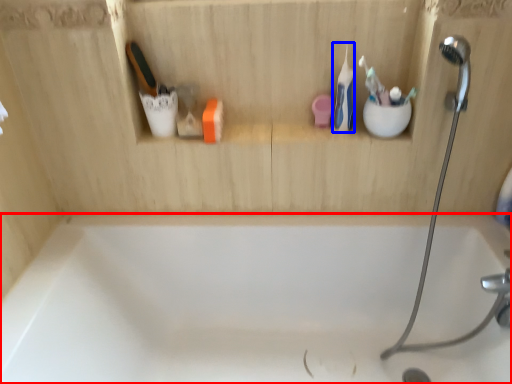
Question: Among these objects, which one is nearest to the camera, bathtub (highlighted by a red box) or toothbrush (highlighted by a blue box)?

Choices:
 (A) bathtub
 (B) toothbrush

Answer: (A)